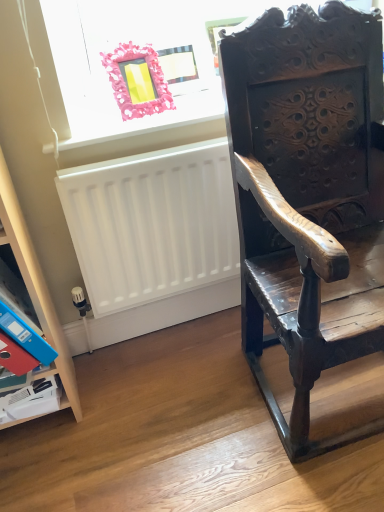
You are a GUI agent. You are given a task and a screenshot of the screen. Output one action in this format:
    pyautogui.click(x=<x>, y=<y>)
    Task: Click on the vacant space that is in between wooden shelf at lower left and white matte radiator at lower left
    
    Given the screenshot: What is the action you would take?
    pyautogui.click(x=142, y=367)